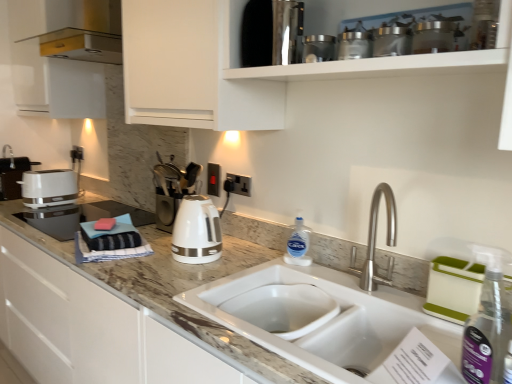
Image resolution: width=512 pixels, height=384 pixels. What are the coordinates of `vacant space to the right of clear plastic bottle at sink, which is counted as the 2th bottle, starting from the right` in the screenshot? It's located at (326, 268).